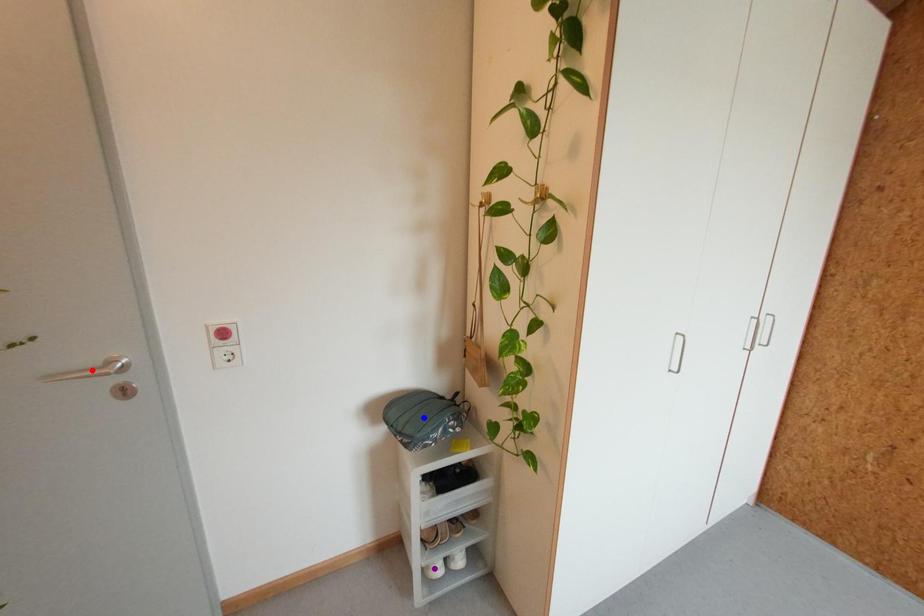
Order these from nearest to farthest:
red point | blue point | purple point

1. blue point
2. purple point
3. red point